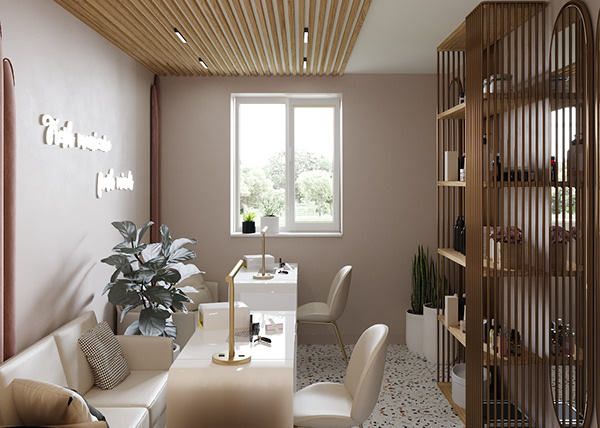
Image resolution: width=600 pixels, height=428 pixels. I want to click on table, so click(277, 280), click(193, 360).